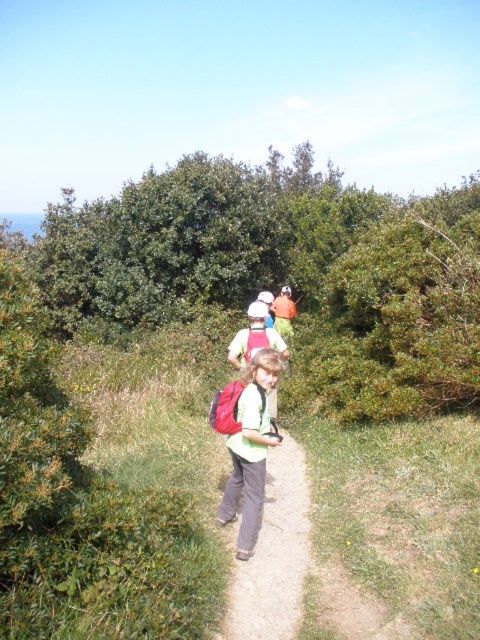
Who is lower down, green fabric backpack at center or matte green shirt at center?

green fabric backpack at center

This screenshot has width=480, height=640. What are the coordinates of `green fabric backpack at center` in the screenshot? It's located at (273, 554).

Identify the location of green fabric backpack at center. (273, 554).